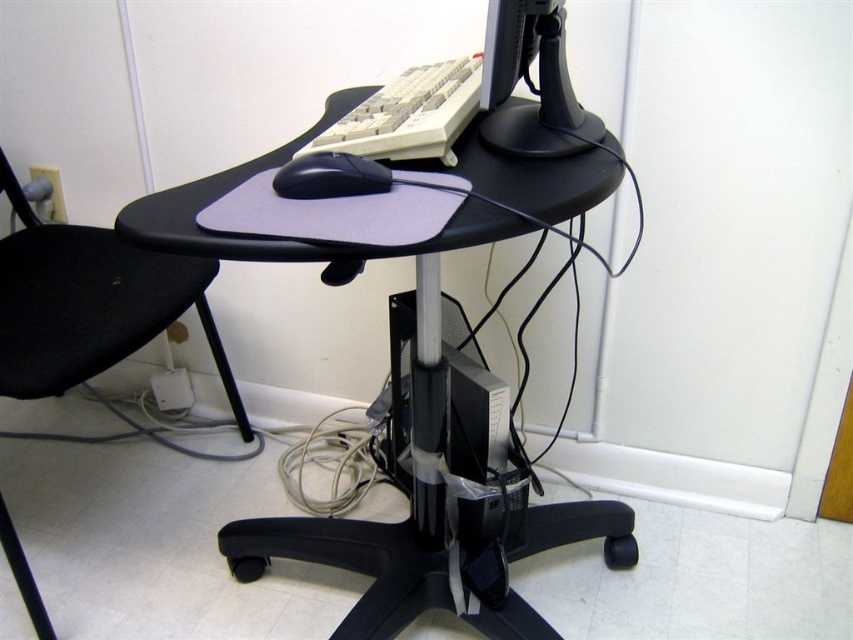
You are standing in front of the desk and want to reach the point at coordinates point (532, 52). Given that your arm can extend 30 inches, can you reach that point without moving closer?

The distance between you and point (532, 52) is 32.07 inches, which is beyond your arm reach of 30 inches. Therefore, you cannot reach it without moving closer.

You are setting up your home office and want to place a new keyboard between the matte black monitor at upper center and the black matte mouse at center. Based on their positions, which object should the keyboard be closer to?

The matte black monitor at upper center is closer to the viewer than the black matte mouse at center, so the keyboard should be placed closer to the matte black monitor at upper center.

You are organizing cables under the desk and need to locate the black matte mouse at center. Is it positioned in front of or behind the black fabric chair at left?

The black matte mouse at center is behind the black fabric chair at left, so it is positioned behind.